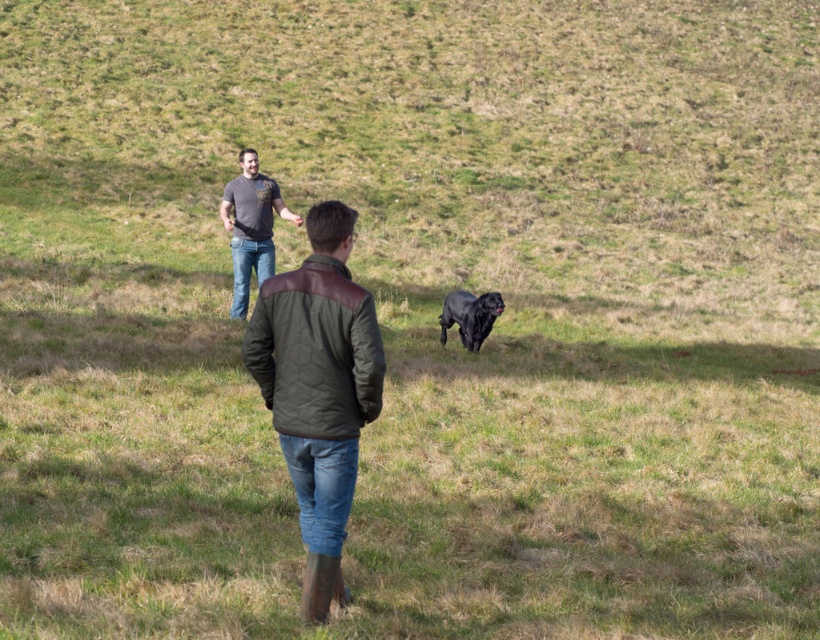
Question: In this image, where is matte gray t-shirt at upper left located relative to black matte dog at center?

Choices:
 (A) below
 (B) above

Answer: (B)

Question: Which of these objects is positioned farthest from the black matte dog at center?

Choices:
 (A) matte gray t-shirt at upper left
 (B) dark green quilted jacket at center

Answer: (B)

Question: Among these objects, which one is nearest to the camera?

Choices:
 (A) matte gray t-shirt at upper left
 (B) dark green quilted jacket at center

Answer: (B)

Question: Does matte gray t-shirt at upper left appear on the right side of black matte dog at center?

Choices:
 (A) no
 (B) yes

Answer: (A)

Question: Which is nearer to the matte gray t-shirt at upper left?

Choices:
 (A) black matte dog at center
 (B) dark green quilted jacket at center

Answer: (A)

Question: Observing the image, what is the correct spatial positioning of matte gray t-shirt at upper left in reference to black matte dog at center?

Choices:
 (A) left
 (B) right

Answer: (A)